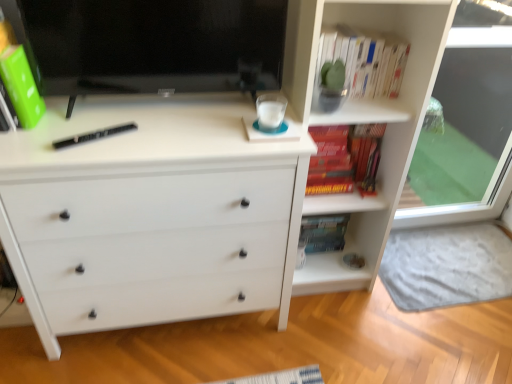
Where is `free space in front of green matte book at upper left, which ranks as the second paperback book in bottom-to-top order`? free space in front of green matte book at upper left, which ranks as the second paperback book in bottom-to-top order is located at coordinates (23, 152).